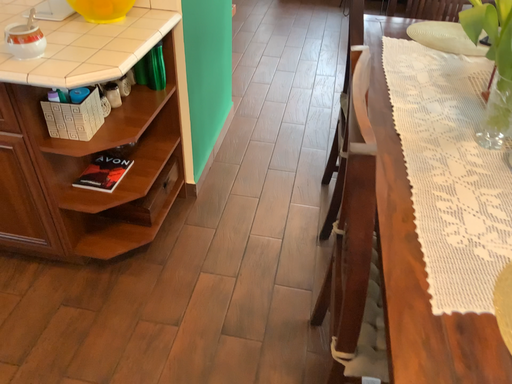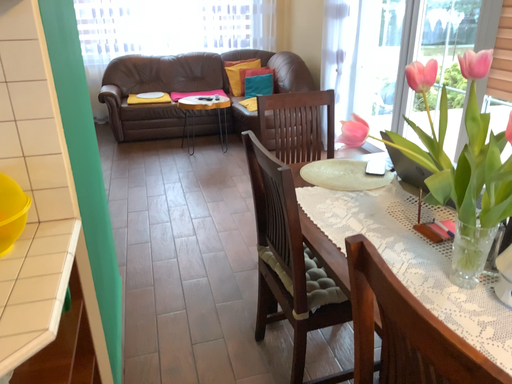
Question: How did the camera likely rotate when shooting the video?

Choices:
 (A) rotated left
 (B) rotated right

Answer: (B)